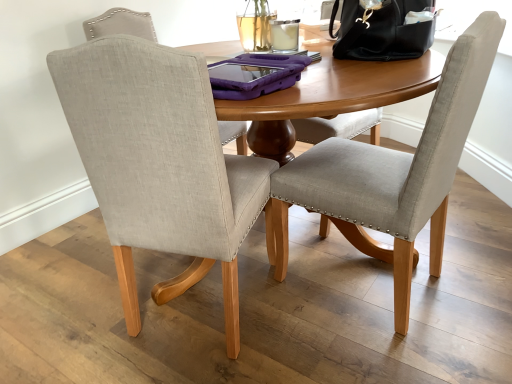
Identify the location of vacant space to the right of light gray fabric chair at center, which ranks as the 1th chair in right-to-left order. (x=475, y=265).